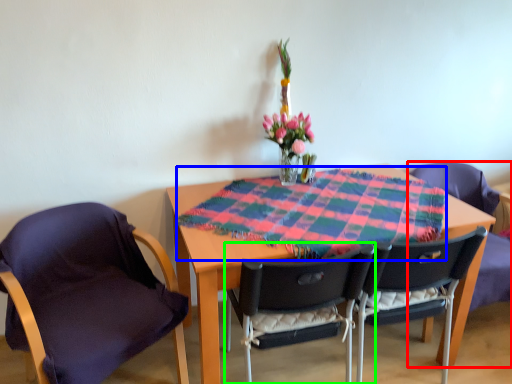
Question: Considering the real-world distances, which object is closest to chair (highlighted by a red box)? blanket (highlighted by a blue box) or chair (highlighted by a green box).

Choices:
 (A) blanket
 (B) chair

Answer: (A)